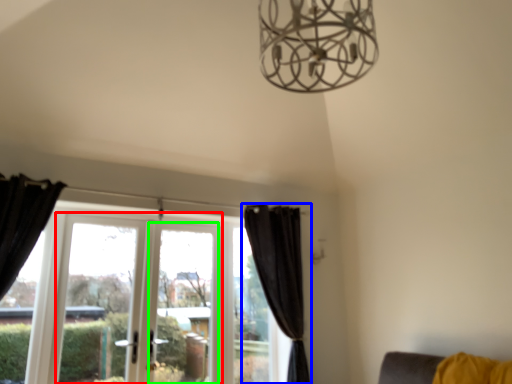
Question: Estimate the real-world distances between objects in this image. Which object is farther from screen door (highlighted by a red box), curtain (highlighted by a blue box) or window screen (highlighted by a green box)?

Choices:
 (A) curtain
 (B) window screen

Answer: (A)